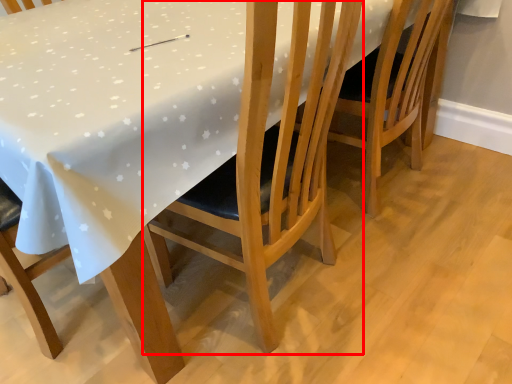
Question: From the image's perspective, where is chair (annotated by the red box) located relative to chair?

Choices:
 (A) above
 (B) below

Answer: (B)